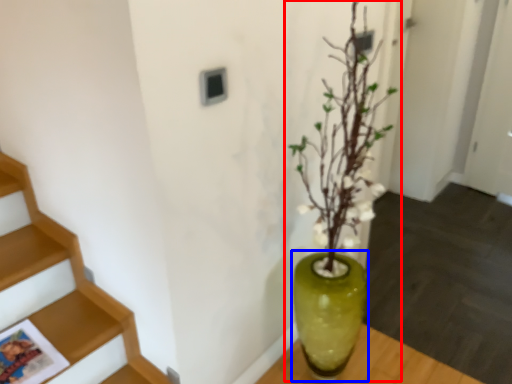
Question: Which point is closer to the camera, houseplant (highlighted by a red box) or vase (highlighted by a blue box)?

Choices:
 (A) houseplant
 (B) vase

Answer: (A)